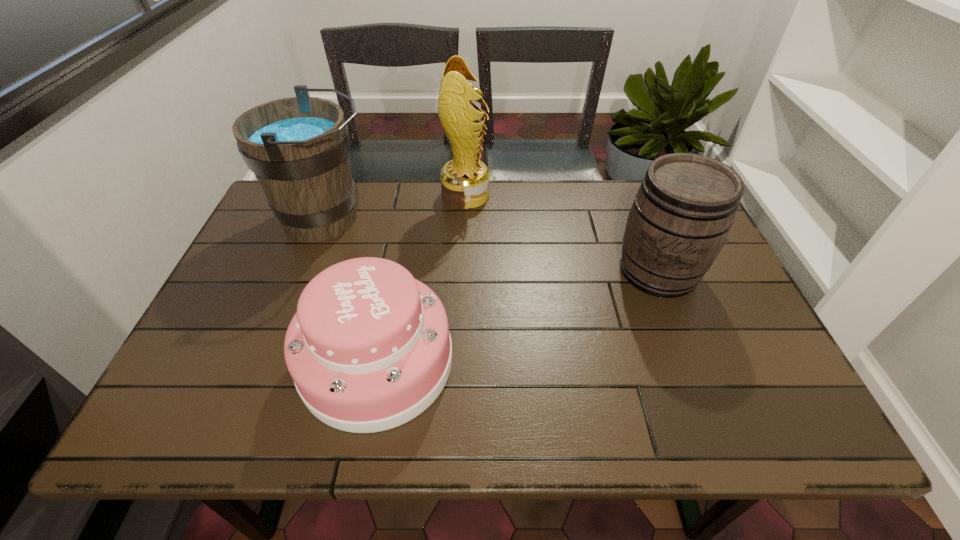
Find the location of `award at the far edge`. award at the far edge is located at coordinates [465, 181].

This screenshot has height=540, width=960. Identify the location of wine bucket that is positioned at the far edge. (298, 147).

Find the location of `object present at the near edge`. object present at the near edge is located at coordinates (369, 349).

What are the coordinates of `object present at the left edge` in the screenshot? It's located at (298, 147).

This screenshot has height=540, width=960. Find the location of `object that is at the right edge`. object that is at the right edge is located at coordinates (680, 218).

Find the location of a particular element. This screenshot has height=540, width=960. object that is at the far left corner is located at coordinates (298, 147).

This screenshot has width=960, height=540. Identify the location of free location at the far edge. (608, 187).

I want to click on free region at the near edge, so click(x=451, y=430).

Identify the location of free space at the left edge. Image resolution: width=960 pixels, height=540 pixels. (238, 372).

At what (x,y) coordinates should I click in order to perform the action: click on vacant area that lies between the rightmost object and the award. Please return your answer as a coordinate pair (x, y). The width and height of the screenshot is (960, 540). Looking at the image, I should click on (562, 233).